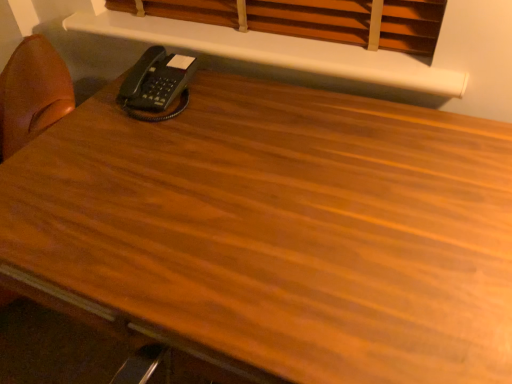
Where is `vacant space underneath wooden blinds at upper center (from a real-world perspective)`? This screenshot has width=512, height=384. vacant space underneath wooden blinds at upper center (from a real-world perspective) is located at coordinates (229, 22).